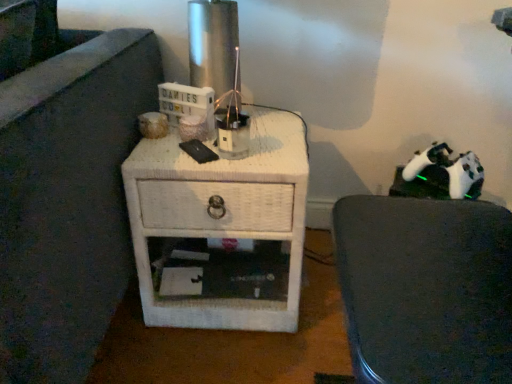
Measure the distance between white wicker nightstand at center and camera.

The distance of white wicker nightstand at center from camera is 36.38 inches.

This screenshot has width=512, height=384. Find the location of `white wicker nightstand at center`. white wicker nightstand at center is located at coordinates (222, 216).

This screenshot has width=512, height=384. What do you see at coordinates (222, 216) in the screenshot?
I see `white wicker nightstand at center` at bounding box center [222, 216].

The image size is (512, 384). Describe the element at coordinates (426, 289) in the screenshot. I see `white matte chair at right` at that location.

Image resolution: width=512 pixels, height=384 pixels. What are the coordinates of `white matte chair at right` in the screenshot? It's located at (426, 289).

Locate an element on the screen. The height and width of the screenshot is (384, 512). white wicker nightstand at center is located at coordinates (222, 216).

Considering the relative positions of white wicker nightstand at center and white matte chair at right in the image provided, is white wicker nightstand at center to the right of white matte chair at right from the viewer's perspective?

No, white wicker nightstand at center is not to the right of white matte chair at right.

Is white wicker nightstand at center in front of white matte chair at right?

No, white wicker nightstand at center is behind white matte chair at right.

Is point (215, 215) closer to camera compared to point (503, 285)?

No, it is behind (503, 285).

From the image's perspective, is white wicker nightstand at center beneath white matte chair at right?

Incorrect, from the image's perspective, white wicker nightstand at center is higher than white matte chair at right.

From a real-world perspective, is white wicker nightstand at center below white matte chair at right?

Correct, in the physical world, white wicker nightstand at center is lower than white matte chair at right.

Can you confirm if white wicker nightstand at center is thinner than white matte chair at right?

No.

Which of these two, white wicker nightstand at center or white matte chair at right, stands shorter?

white wicker nightstand at center is shorter.

Does white wicker nightstand at center have a smaller size compared to white matte chair at right?

Incorrect, white wicker nightstand at center is not smaller in size than white matte chair at right.

Is white matte chair at right surrounded by white wicker nightstand at center?

No, white matte chair at right is located outside of white wicker nightstand at center.

Consider the image. Is white wicker nightstand at center beside white matte chair at right?

No, white wicker nightstand at center is not touching white matte chair at right.

Is white wicker nightstand at center oriented away from white matte chair at right?

No, white wicker nightstand at center's orientation is not away from white matte chair at right.

Can you tell me how much white wicker nightstand at center and white matte chair at right differ in facing direction?

They differ by 90.7 degrees in their facing directions.

In order to click on furniture in front of the white wicker nightstand at center in this screenshot , I will do `click(426, 289)`.

Which object is positioned more to the right, white matte chair at right or white wicker nightstand at center?

Positioned to the right is white matte chair at right.

Considering their positions, is white matte chair at right located in front of or behind white wicker nightstand at center?

white matte chair at right is positioned closer to the viewer than white wicker nightstand at center.

Is point (503, 249) farther from camera compared to point (303, 237)?

No, (503, 249) is closer to viewer.

From the image's perspective, is white matte chair at right on top of white wicker nightstand at center?

No, from the image's perspective, white matte chair at right is not on top of white wicker nightstand at center.

Based on the photo, from a real-world perspective, who is located lower, white matte chair at right or white wicker nightstand at center?

From a 3D spatial view, white wicker nightstand at center is below.

Which of these two, white matte chair at right or white wicker nightstand at center, is thinner?

Thinner between the two is white matte chair at right.

Is white matte chair at right shorter than white wicker nightstand at center?

Incorrect, the height of white matte chair at right does not fall short of that of white wicker nightstand at center.

Can you confirm if white matte chair at right is smaller than white wicker nightstand at center?

Yes.

Is white wicker nightstand at center located within white matte chair at right?

Actually, white wicker nightstand at center is outside white matte chair at right.

Is there a large distance between white matte chair at right and white wicker nightstand at center?

Actually, white matte chair at right and white wicker nightstand at center are a little close together.

Is white matte chair at right aimed at white wicker nightstand at center?

No, white matte chair at right is not aimed at white wicker nightstand at center.

How different are the orientations of white matte chair at right and white wicker nightstand at center in degrees?

The facing directions of white matte chair at right and white wicker nightstand at center are 90.7 degrees apart.

Image resolution: width=512 pixels, height=384 pixels. Identify the location of furniture above the white wicker nightstand at center (from a real-world perspective). (426, 289).

Locate an element on the screen. The width and height of the screenshot is (512, 384). nightstand above the white matte chair at right (from the image's perspective) is located at coordinates [222, 216].

At what (x,y) coordinates should I click in order to perform the action: click on furniture on the right of white wicker nightstand at center. Please return your answer as a coordinate pair (x, y). Looking at the image, I should click on (426, 289).